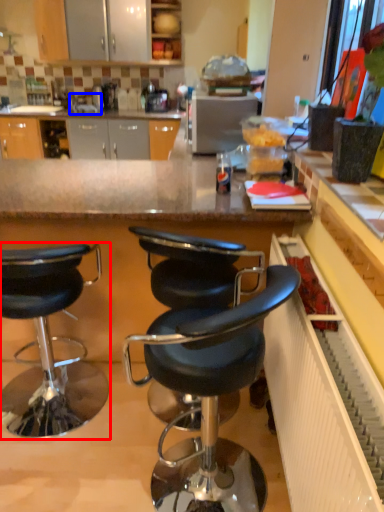
Question: Among these objects, which one is nearest to the camera, chair (highlighted by a red box) or sink (highlighted by a blue box)?

Choices:
 (A) chair
 (B) sink

Answer: (A)